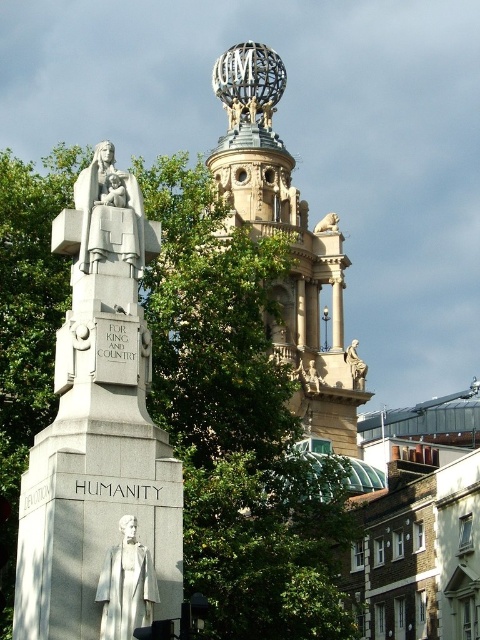
You are an architect designing a new plaza and want to place a new sculpture between the gold ornate tower at center and the white marble statue at center. The sculpture requires a space that is wider than the narrower of the two existing structures. Which structure determines the minimum width required for the sculpture?

The white marble statue at center is narrower, so the minimum width required for the sculpture must be wider than the white marble statue at center.

You are standing in front of the monument and want to take a photo that includes both the gold ornate tower at center and the polished bronze statue at upper right. Which object should you position to your left to ensure both are in the frame?

The gold ornate tower at center is to the left of the polished bronze statue at upper right, so you should position the gold ornate tower at center to your left to include both in the frame.

You are standing in front of the monument and want to touch both points on the monument. Which point should you reach for first, the point at coordinate (294, 269) or the point at coordinate (146, 588)?

You should reach for point (294, 269) first because it is closer to you than point (146, 588), which is further away.